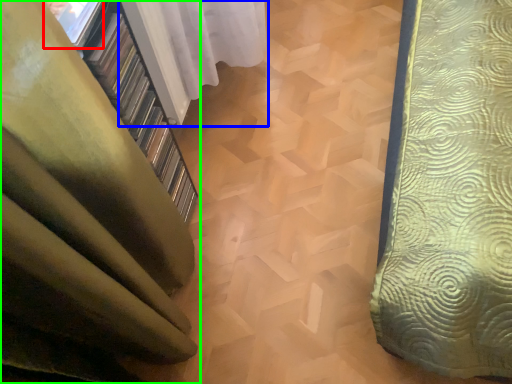
Question: Which object is positioned farthest from window (highlighted by a red box)? Select from curtain (highlighted by a blue box) and curtain (highlighted by a green box).

Choices:
 (A) curtain
 (B) curtain

Answer: (A)